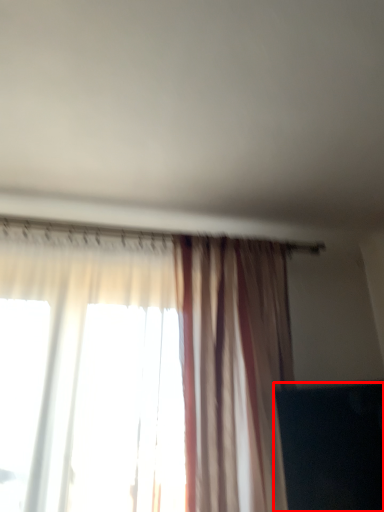
Question: From the image's perspective, what is the correct spatial positioning of dark (annotated by the red box) in reference to curtain?

Choices:
 (A) below
 (B) above

Answer: (A)